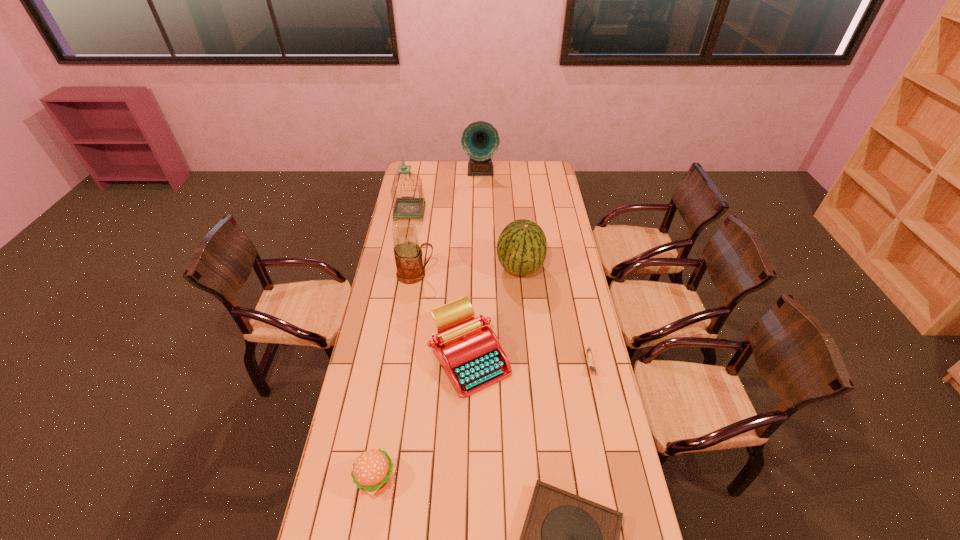
This screenshot has width=960, height=540. Find the location of `vacant space located 0.310m on the back of the watermelon`. vacant space located 0.310m on the back of the watermelon is located at coordinates (515, 215).

Locate an element on the screen. The width and height of the screenshot is (960, 540). free space located with the handle on the side of the pitcher is located at coordinates (499, 274).

The width and height of the screenshot is (960, 540). What are the coordinates of `vacant space located on the typing side of the fifth tallest object` in the screenshot? It's located at (468, 453).

Where is `vacant point located 0.190m on the back of the sixth tallest object`? vacant point located 0.190m on the back of the sixth tallest object is located at coordinates (388, 406).

Where is `vacant space located on the peel of the banana`? This screenshot has height=540, width=960. vacant space located on the peel of the banana is located at coordinates (596, 394).

At what (x,y) coordinates should I click in order to perform the action: click on object that is at the far edge. Please return your answer as a coordinate pair (x, y). This screenshot has width=960, height=540. Looking at the image, I should click on (480, 140).

Find the location of a particular element. The image size is (960, 540). birdcage that is at the left edge is located at coordinates (407, 207).

This screenshot has height=540, width=960. Find the location of `pitcher at the left edge`. pitcher at the left edge is located at coordinates (408, 254).

Locate an element on the screen. hamburger at the left edge is located at coordinates (372, 470).

What are the coordinates of `watermelon located in the right edge section of the desktop` in the screenshot? It's located at (521, 248).